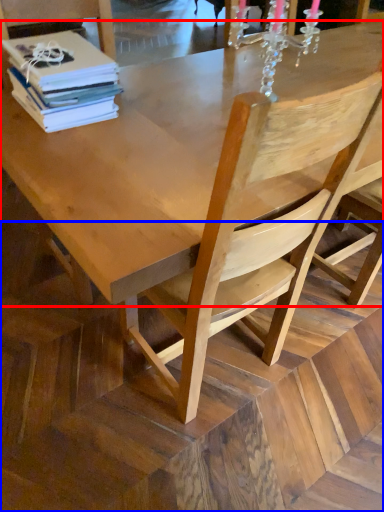
Question: Which point is further to the camera, round table (highlighted by a red box) or stair (highlighted by a blue box)?

Choices:
 (A) round table
 (B) stair

Answer: (A)